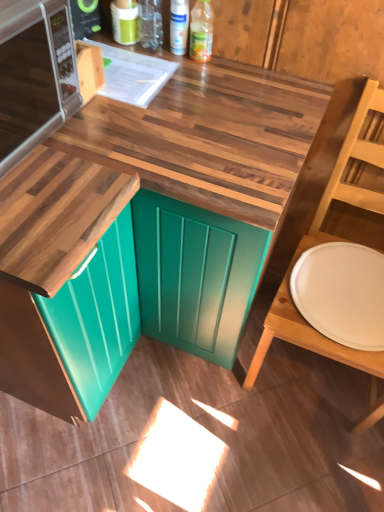
Question: Does wooden chair at right have a smaller size compared to white matte plate at right?

Choices:
 (A) no
 (B) yes

Answer: (A)

Question: Are wooden chair at right and white matte plate at right beside each other?

Choices:
 (A) yes
 (B) no

Answer: (B)

Question: From a real-world perspective, is wooden chair at right below white matte plate at right?

Choices:
 (A) yes
 (B) no

Answer: (A)

Question: Is wooden chair at right oriented towards white matte plate at right?

Choices:
 (A) no
 (B) yes

Answer: (B)

Question: Is wooden chair at right outside of white matte plate at right?

Choices:
 (A) no
 (B) yes

Answer: (B)

Question: Is wooden chair at right bigger than white matte plate at right?

Choices:
 (A) no
 (B) yes

Answer: (B)

Question: From a real-world perspective, is wooden chair at right positioned over white glossy spray can at upper center, which appears as the first bottle when viewed from the left, based on gravity?

Choices:
 (A) yes
 (B) no

Answer: (B)

Question: Does wooden chair at right appear on the left side of white glossy spray can at upper center, which appears as the first bottle when viewed from the left?

Choices:
 (A) yes
 (B) no

Answer: (B)

Question: Is wooden chair at right facing towards white glossy spray can at upper center, positioned as the second bottle in right-to-left order?

Choices:
 (A) no
 (B) yes

Answer: (A)

Question: Is wooden chair at right beside white glossy spray can at upper center, positioned as the second bottle in right-to-left order?

Choices:
 (A) yes
 (B) no

Answer: (B)

Question: Is wooden chair at right wider than white glossy spray can at upper center, positioned as the second bottle in right-to-left order?

Choices:
 (A) yes
 (B) no

Answer: (A)

Question: Is wooden chair at right positioned in front of white glossy spray can at upper center, which appears as the first bottle when viewed from the left?

Choices:
 (A) yes
 (B) no

Answer: (A)

Question: Can you confirm if teal glossy cabinet at lower left is positioned to the left of wooden at center?

Choices:
 (A) yes
 (B) no

Answer: (A)